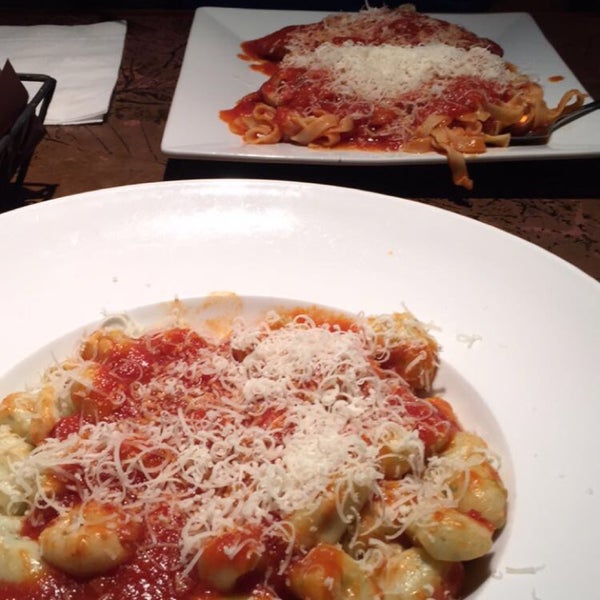
I want to click on plate, so click(194, 96).